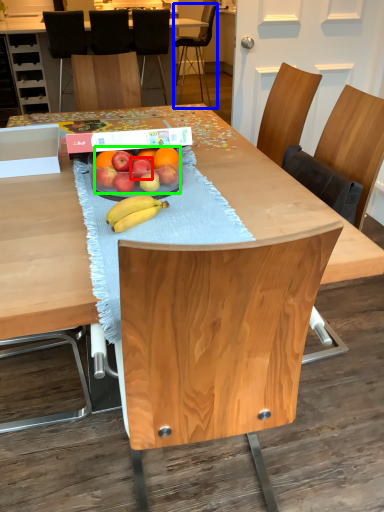
Question: Based on their relative distances, which object is farther from apple (highlighted by a red box)? Choose from chair (highlighted by a blue box) and grapefruit (highlighted by a green box).

Choices:
 (A) chair
 (B) grapefruit

Answer: (A)